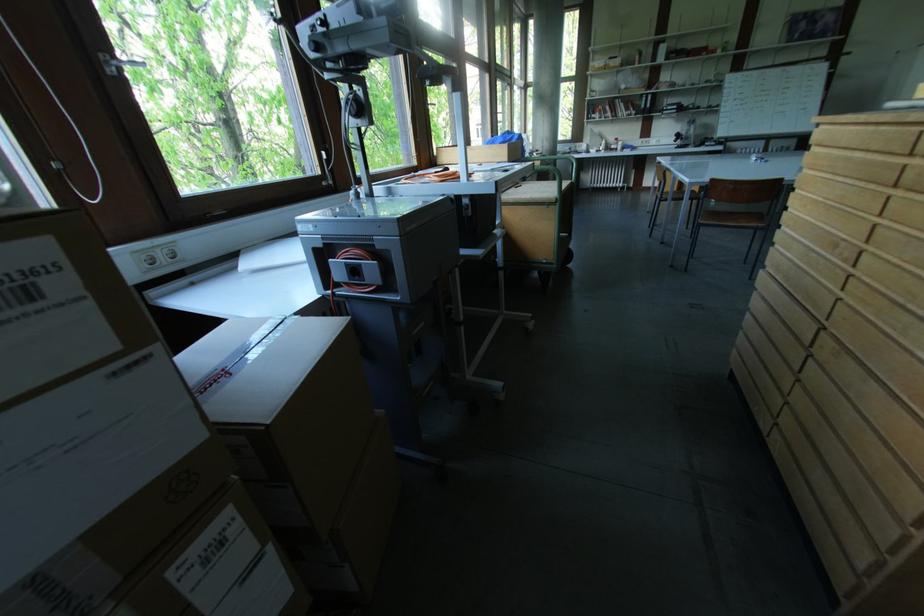
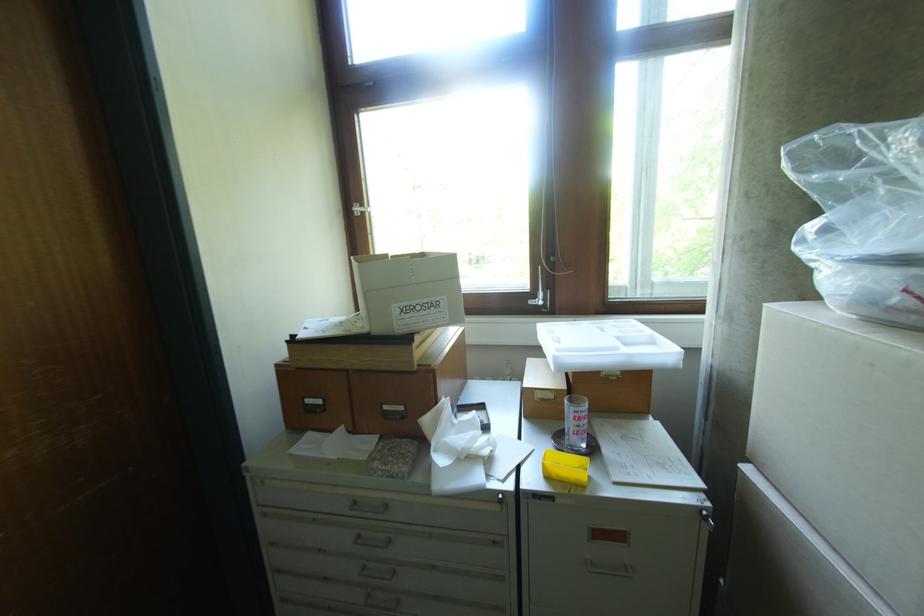
Question: The camera is either moving clockwise (left) or counter-clockwise (right) around the object. The first image is from the beginning of the video and the second image is from the end. Is the camera moving left or right when shooting the video?

Choices:
 (A) Left
 (B) Right

Answer: (B)